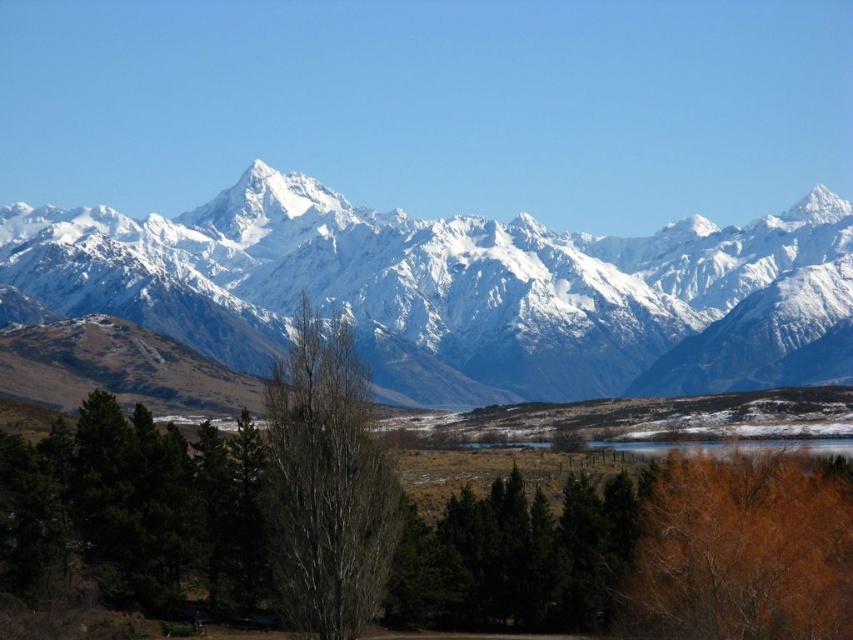
Is point (158, 40) farther from camera compared to point (421, 317)?

Yes, point (158, 40) is farther from viewer.

Where is `white snow-covered mountain at upper center`? The image size is (853, 640). white snow-covered mountain at upper center is located at coordinates (432, 104).

Which is behind, point (456, 26) or point (451, 230)?

The point (456, 26) is behind.

Where is `white snow-covered mountain at upper center`? white snow-covered mountain at upper center is located at coordinates click(432, 104).

Between white snow-covered mountain at upper center and bare bark tree at center, which one appears on the left side from the viewer's perspective?

bare bark tree at center is more to the left.

What do you see at coordinates (432, 104) in the screenshot? This screenshot has width=853, height=640. I see `white snow-covered mountain at upper center` at bounding box center [432, 104].

Identify the location of white snow-covered mountain at upper center. The width and height of the screenshot is (853, 640). (432, 104).

At what (x,y) coordinates should I click in order to perform the action: click on white snow-covered mountain at upper center. Please return your answer as a coordinate pair (x, y). Looking at the image, I should click on (432, 104).

Which is below, brown leafy tree at lower right or bare bark tree at center?

brown leafy tree at lower right is lower down.

Does brown leafy tree at lower right have a smaller size compared to bare bark tree at center?

No, brown leafy tree at lower right is not smaller than bare bark tree at center.

Where is `brown leafy tree at lower right`? The height and width of the screenshot is (640, 853). brown leafy tree at lower right is located at coordinates (743, 548).